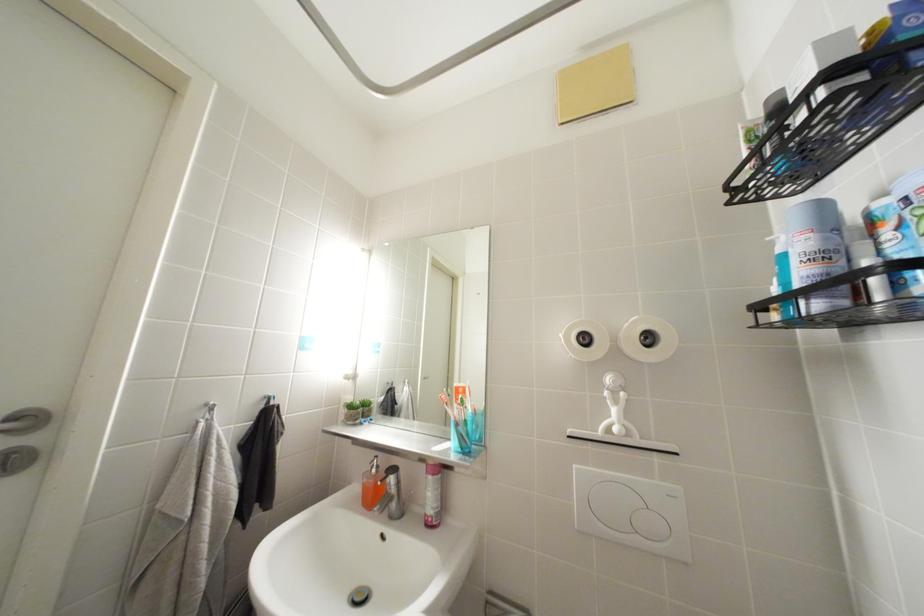
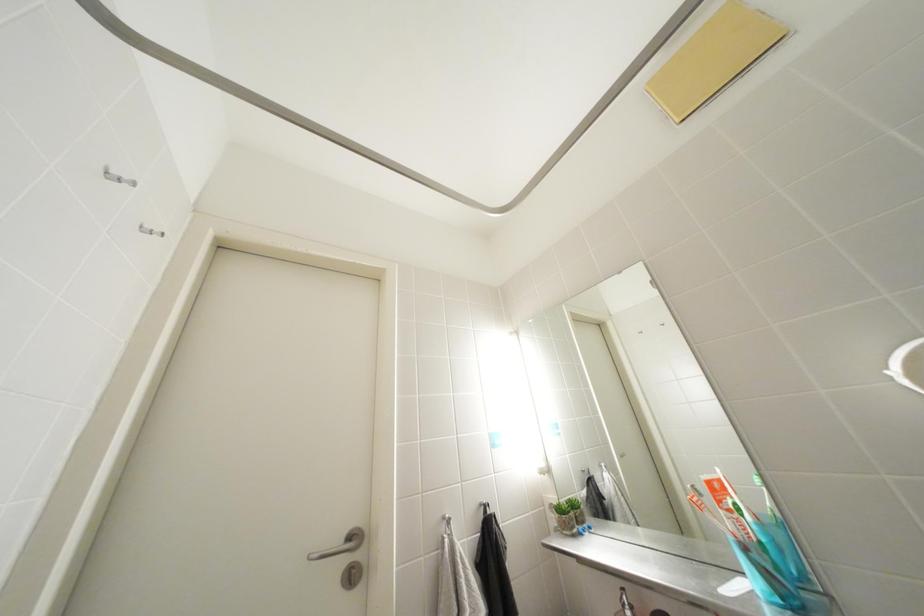
Based on the continuous images, in which direction is the camera rotating?

The camera's rotation is toward left-up.